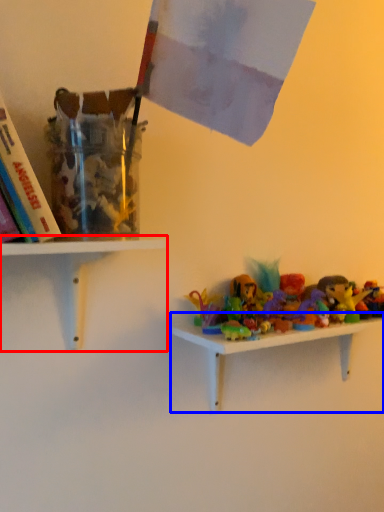
Question: Which point is closer to the camera, shelf (highlighted by a red box) or shelf (highlighted by a blue box)?

Choices:
 (A) shelf
 (B) shelf

Answer: (A)